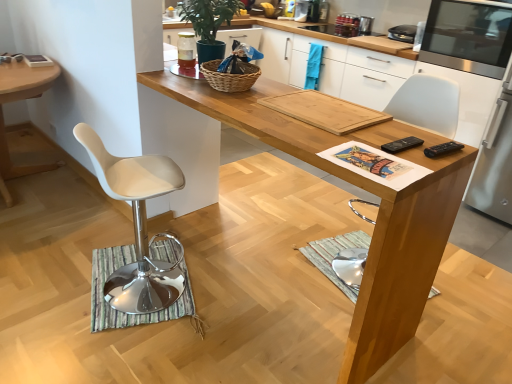
Where is `free area below light brown wood desk at center, the 2th desk viewed from the left (from a real-world perspective)`? The width and height of the screenshot is (512, 384). free area below light brown wood desk at center, the 2th desk viewed from the left (from a real-world perspective) is located at coordinates (268, 274).